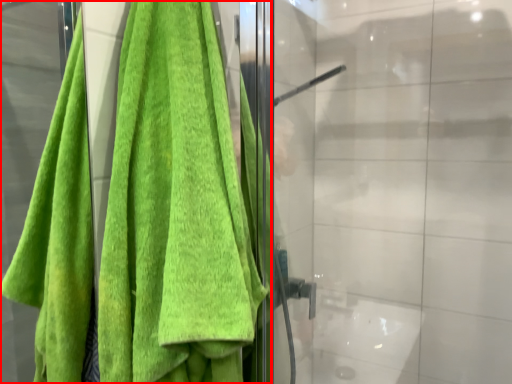
Question: From the image's perspective, what is the correct spatial positioning of towel (annotated by the red box) in reference to glass door?

Choices:
 (A) below
 (B) above

Answer: (B)